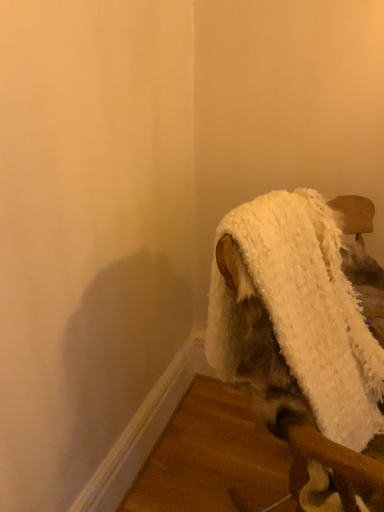
Question: Should I look upward or downward to see white fluffy blanket at upper right?

Choices:
 (A) up
 (B) down

Answer: (B)